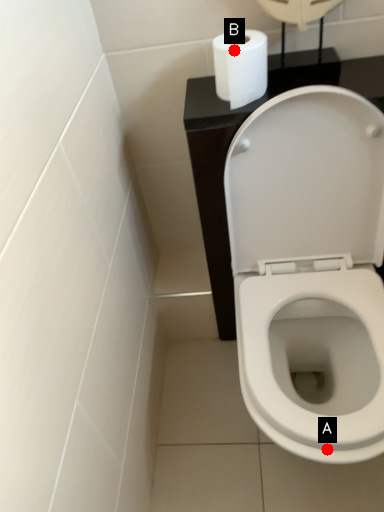
Question: Two points are circled on the image, labeled by A and B beside each circle. Which of the following is the closest to the observer?

Choices:
 (A) A is closer
 (B) B is closer

Answer: (A)